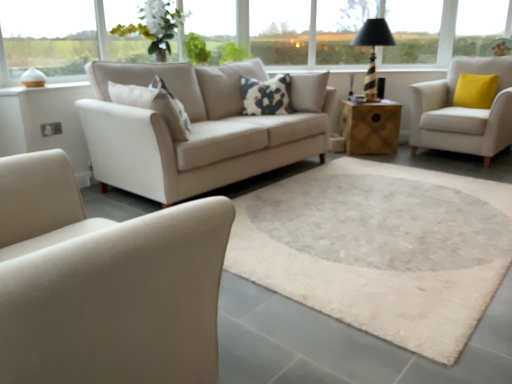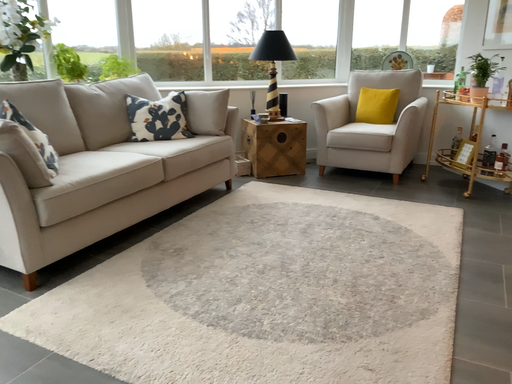
Question: How did the camera likely rotate when shooting the video?

Choices:
 (A) rotated left
 (B) rotated right

Answer: (B)